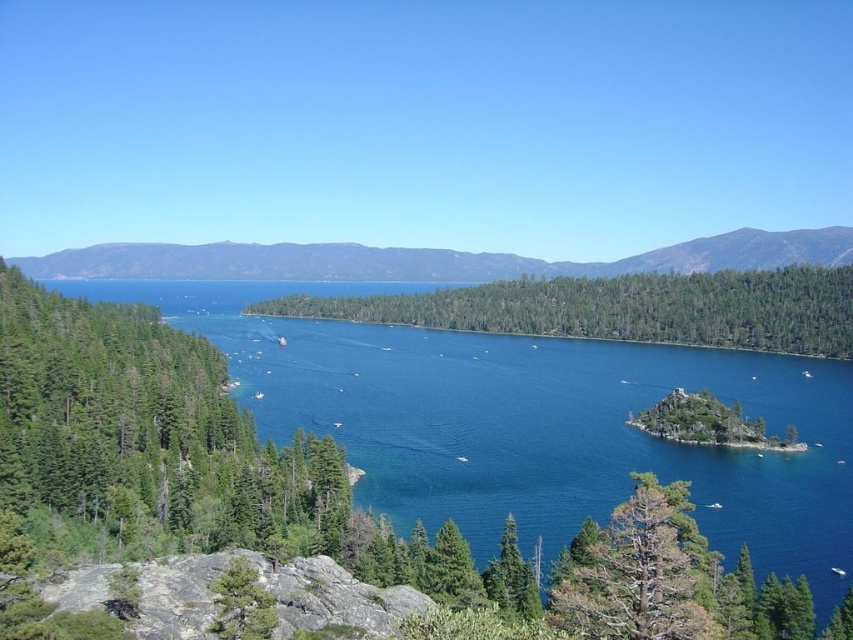
Does deep blue water at center appear over green forested mountain at center?

Actually, deep blue water at center is below green forested mountain at center.

Which is more to the left, deep blue water at center or green forested mountain at center?

From the viewer's perspective, green forested mountain at center appears more on the left side.

Which is behind, point (805, 403) or point (782, 244)?

Point (782, 244)

Locate an element on the screen. Image resolution: width=853 pixels, height=640 pixels. deep blue water at center is located at coordinates click(531, 422).

Looking at this image, which is below, green forested mountain at center or green textured tree at center right?

Positioned lower is green textured tree at center right.

Can you confirm if green forested mountain at center is positioned to the right of green textured tree at center right?

No, green forested mountain at center is not to the right of green textured tree at center right.

Measure the distance between point (129, 253) and camera.

The distance of point (129, 253) from camera is 653.05 meters.

At what (x,y) coordinates should I click in order to perform the action: click on green forested mountain at center. Please return your answer as a coordinate pair (x, y). This screenshot has height=640, width=853. Looking at the image, I should click on (427, 259).

Is point (799, 545) closer to viewer compared to point (564, 596)?

No, (799, 545) is further to viewer.

At what (x,y) coordinates should I click in order to perform the action: click on deep blue water at center. Please return your answer as a coordinate pair (x, y). The image size is (853, 640). Looking at the image, I should click on (531, 422).